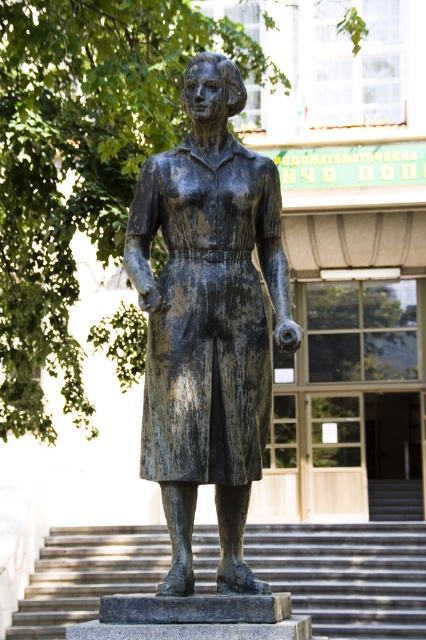
Which is in front, point (239, 360) or point (100, 572)?

Point (239, 360)

Is bronze statue at center wider than smooth concrete stairs at center?

No.

Where is `bronze statue at center`? This screenshot has height=640, width=426. bronze statue at center is located at coordinates (207, 320).

Find the location of a particular element. The height and width of the screenshot is (640, 426). bronze statue at center is located at coordinates (207, 320).